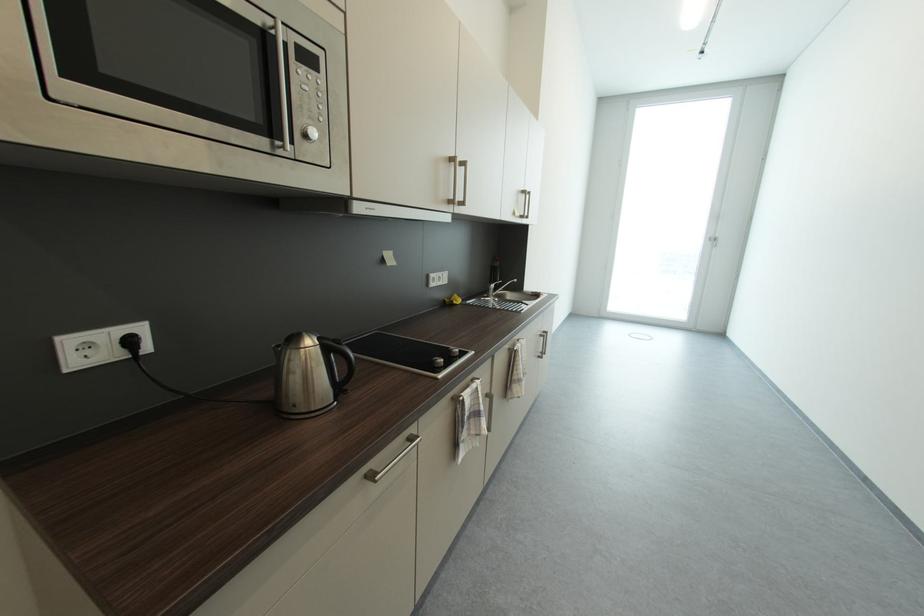
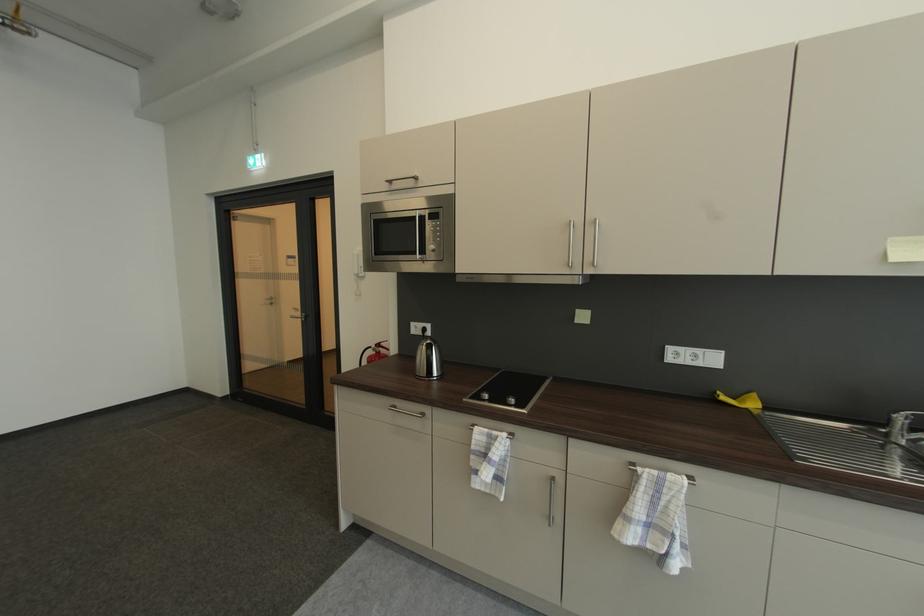
Find the pixel in the second image that matches point (338, 402) in the first image.

(432, 378)